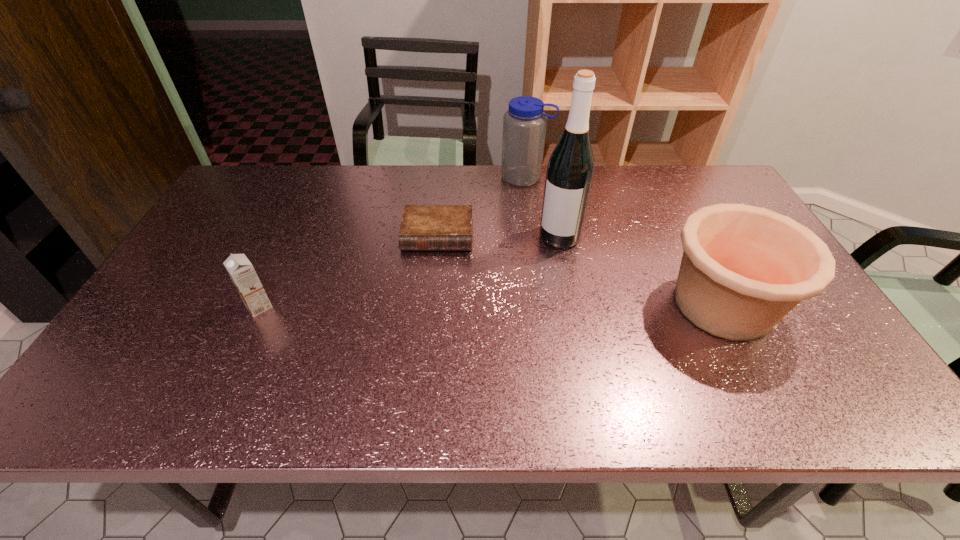
This screenshot has height=540, width=960. Find the location of `vacant space situated 0.310m on the back of the rightmost object`. vacant space situated 0.310m on the back of the rightmost object is located at coordinates (667, 197).

The height and width of the screenshot is (540, 960). Identify the location of free space located with a carrying loop on the side of the farthest object. (487, 225).

This screenshot has height=540, width=960. I want to click on vacant area located with a carrying loop on the side of the farthest object, so click(x=468, y=251).

You are a GUI agent. You are given a task and a screenshot of the screen. Output one action in this format:
    pyautogui.click(x=<x>, y=<y>)
    Task: Click on the vacant area located with a carrying loop on the side of the farthest object
    
    Given the screenshot: What is the action you would take?
    pyautogui.click(x=498, y=210)

Find the location of a particular element. vacant space located on the spine side of the fourth object from right to left is located at coordinates (427, 325).

This screenshot has height=540, width=960. I want to click on vacant space located on the spine side of the fourth object from right to left, so click(432, 286).

Locate an element on the screen. free region located 0.130m on the spine side of the fourth object from right to left is located at coordinates (432, 288).

At what (x,y) coordinates should I click in order to perform the action: click on free spot located 0.200m on the label of the wine bottle. Please return your answer as a coordinate pair (x, y). Image resolution: width=960 pixels, height=540 pixels. Looking at the image, I should click on (526, 296).

You are a GUI agent. You are given a task and a screenshot of the screen. Output one action in this format:
    pyautogui.click(x=<x>, y=<y>)
    Task: Click on the vacant space located on the label of the wine bottle
    This screenshot has height=540, width=960.
    Given the screenshot: What is the action you would take?
    pyautogui.click(x=520, y=307)

This screenshot has height=540, width=960. I want to click on vacant space located on the label of the wine bottle, so click(x=544, y=264).